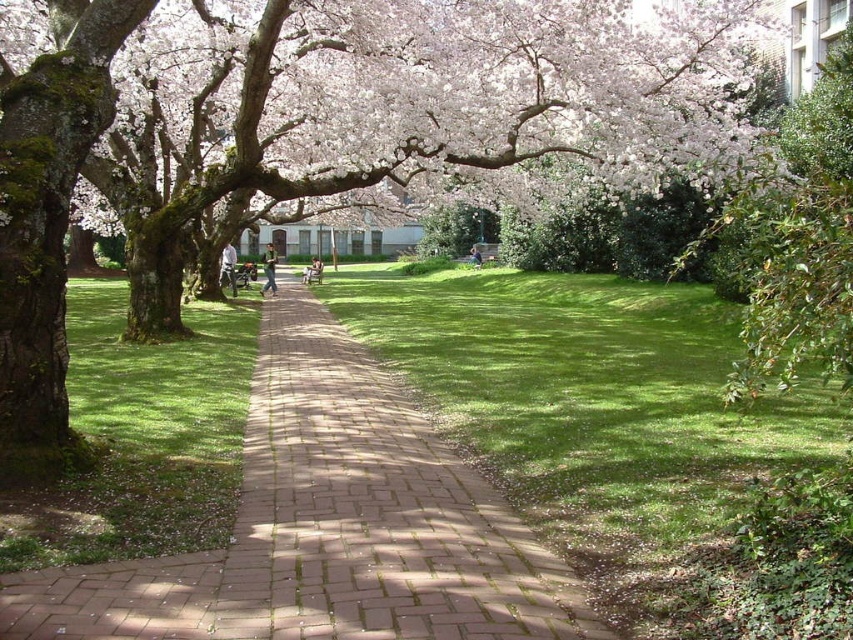
Question: Which of the following is the farthest from the observer?

Choices:
 (A) white blossoms at upper center
 (B) brick pavement at center
 (C) green grass at center

Answer: (A)

Question: Is green mossy tree at center below brick pavement at center?

Choices:
 (A) no
 (B) yes

Answer: (A)

Question: Which of these objects is positioned farthest from the brick pavement at center?

Choices:
 (A) green grass at center
 (B) white blossoms at upper center

Answer: (B)

Question: Is white blossoms at upper center to the left of brick pavement at center from the viewer's perspective?

Choices:
 (A) no
 (B) yes

Answer: (A)

Question: Based on their relative distances, which object is farther from the green mossy tree at center?

Choices:
 (A) white blossoms at upper center
 (B) green grass at center

Answer: (B)

Question: Is green mossy tree at center above green grass at center?

Choices:
 (A) yes
 (B) no

Answer: (A)